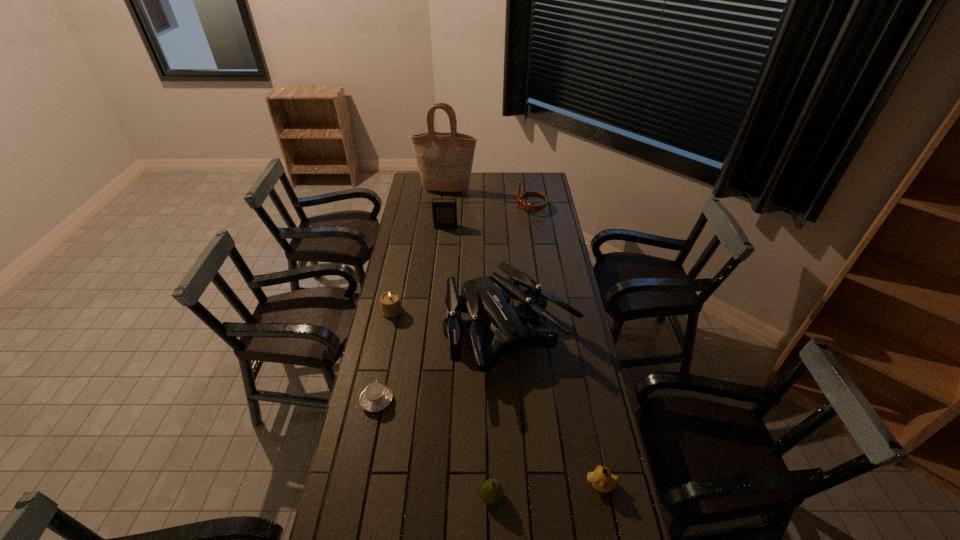
Find the location of a particular element. free space located 0.240m on the front-facing side of the tiara is located at coordinates (472, 208).

Where is `vacant space located 0.300m on the front-facing side of the tiara`? The image size is (960, 540). vacant space located 0.300m on the front-facing side of the tiara is located at coordinates (461, 208).

Identify the location of vacant space positioned on the front-facing side of the tiara. Image resolution: width=960 pixels, height=540 pixels. (470, 208).

Identify the location of vacant region located 0.210m on the front of the drone. [518, 451].

At what (x,y) coordinates should I click in order to perform the action: click on vacant space situated 0.160m on the front cover of the diary. Please return your answer as a coordinate pair (x, y). Looking at the image, I should click on (444, 248).

Identify the location of free space located on the right of the fourth shortest object. pyautogui.click(x=429, y=312).

Where is `vacant region located on the left of the pear`? The height and width of the screenshot is (540, 960). vacant region located on the left of the pear is located at coordinates (x=432, y=497).

The image size is (960, 540). In order to click on vacant space located 0.250m on the face of the duckling in this screenshot , I will do point(501,484).

In order to click on vacant area situated 0.380m on the face of the duckling in this screenshot , I will do (458, 484).

This screenshot has height=540, width=960. What are the coordinates of `free space located 0.300m on the face of the duckling` in the screenshot? It's located at (485, 484).